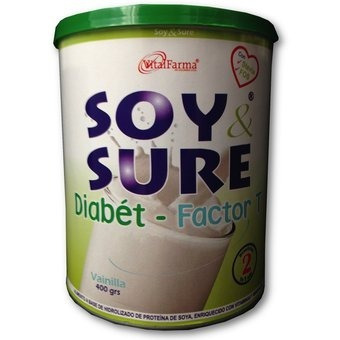
Where is `image of a glass of milk`? This screenshot has width=340, height=340. image of a glass of milk is located at coordinates (161, 255).